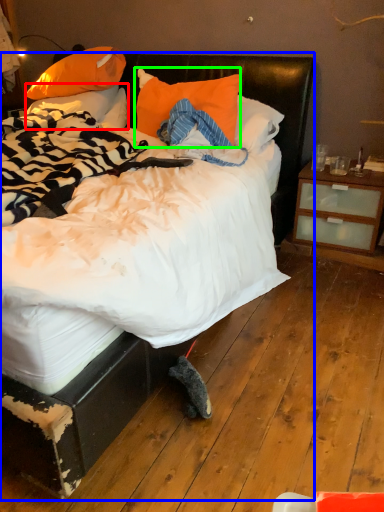
Question: Considering the real-world distances, which object is farthest from pillow (highlighted by a red box)? bed (highlighted by a blue box) or pillow (highlighted by a green box)?

Choices:
 (A) bed
 (B) pillow

Answer: (A)